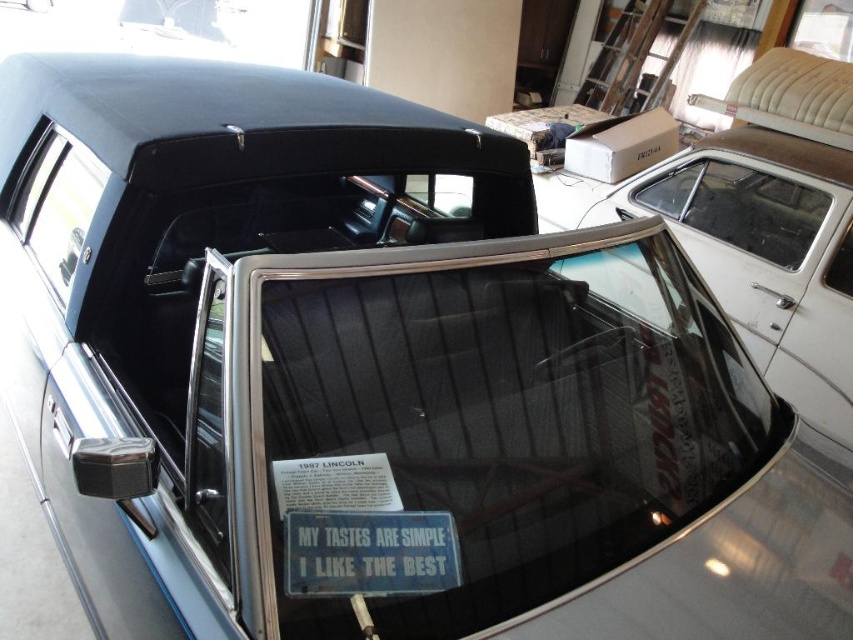
Question: Among these objects, which one is nearest to the camera?

Choices:
 (A) transparent glass window at upper center
 (B) clear glass window at upper left

Answer: (B)

Question: Can you confirm if blue metallic sign at center is wider than clear glass window at upper left?

Choices:
 (A) no
 (B) yes

Answer: (A)

Question: Can you confirm if blue metallic sign at center is positioned above transparent glass window at upper center?

Choices:
 (A) yes
 (B) no

Answer: (B)

Question: Is transparent glass windshield at center smaller than transparent glass window at upper center?

Choices:
 (A) yes
 (B) no

Answer: (B)

Question: Which point is closer to the camera?

Choices:
 (A) clear glass window at upper left
 (B) blue metallic sign at center
 (C) transparent glass windshield at center
 (D) transparent glass window at upper center

Answer: (C)

Question: Based on their relative distances, which object is nearer to the transparent glass windshield at center?

Choices:
 (A) blue metallic sign at center
 (B) clear glass window at upper left
 (C) transparent glass window at upper center

Answer: (A)